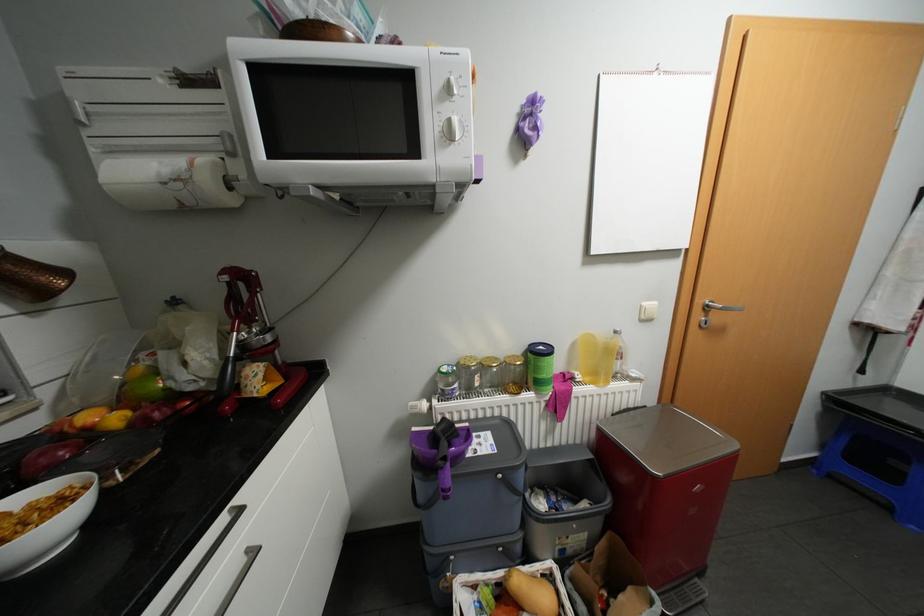
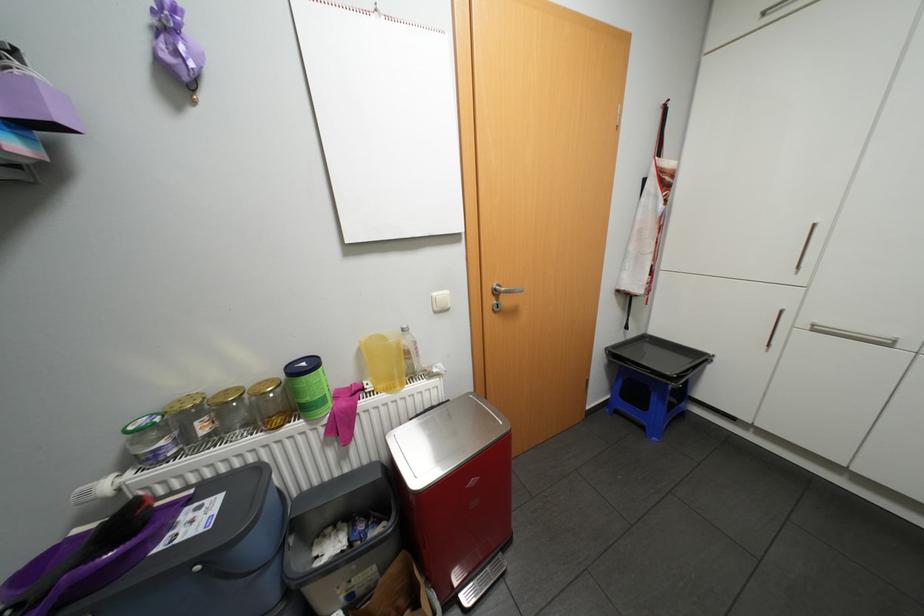
Question: Based on the continuous images, in which direction is the camera rotating? Reply with the corresponding letter.

Choices:
 (A) Left
 (B) Right
 (C) Up
 (D) Down

Answer: (B)